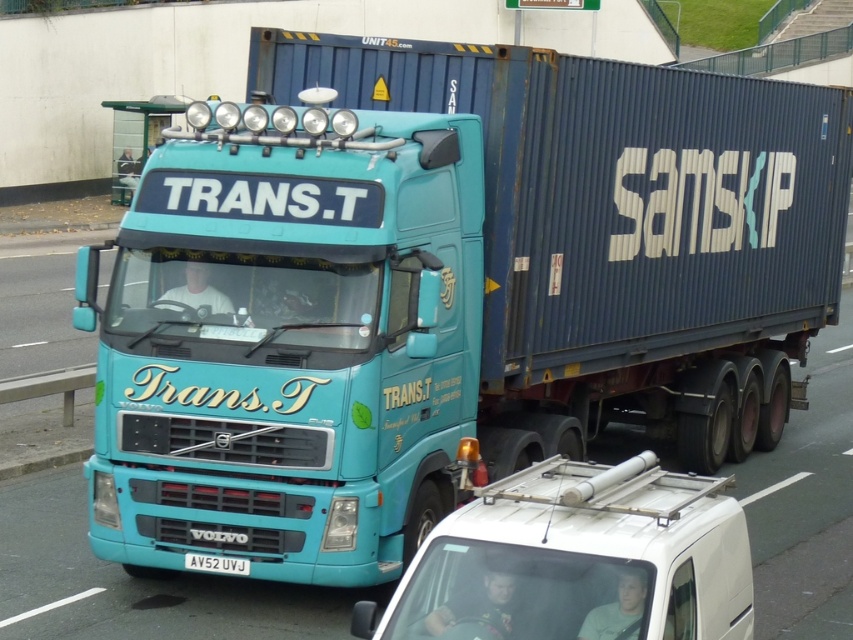
Does white matte van at center appear on the left side of white plastic license plate at center?

No, white matte van at center is not to the left of white plastic license plate at center.

This screenshot has width=853, height=640. I want to click on white matte van at center, so click(578, 561).

Identify the location of white matte van at center. (578, 561).